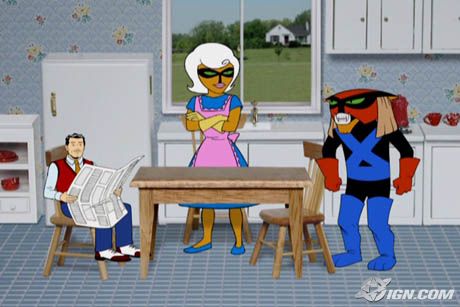
Locate an element on the screen. The image size is (460, 307). fridge is located at coordinates (88, 102).